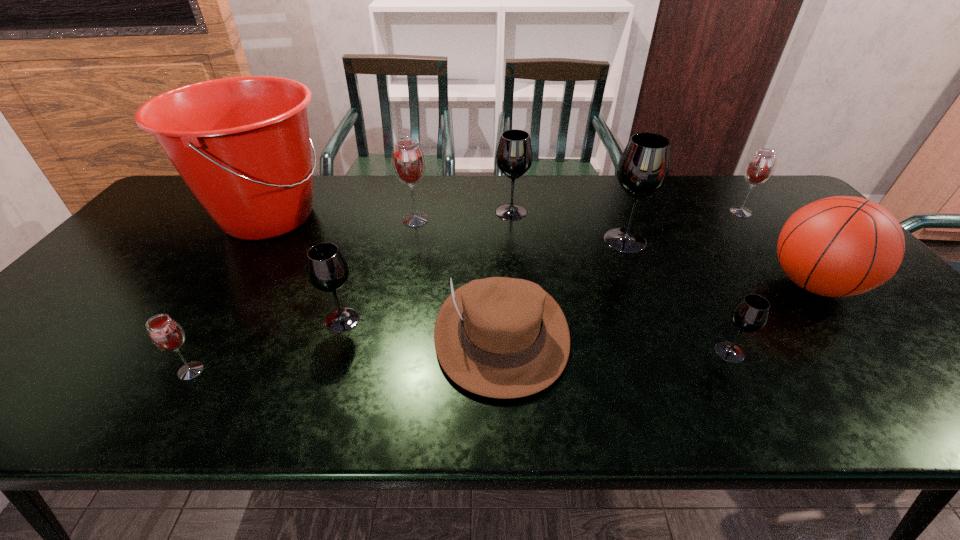
Find the location of a particular element. bucket is located at coordinates (241, 144).

Where is `red bucket`? red bucket is located at coordinates tap(241, 144).

At what (x,y) coordinates should I click in order to perform the action: click on the second tallest object. Please return your answer as a coordinate pair (x, y). Image resolution: width=960 pixels, height=540 pixels. Looking at the image, I should click on (643, 168).

Locate an element on the screen. The height and width of the screenshot is (540, 960). the third gray wineglass from left to right is located at coordinates (643, 168).

At what (x,y) coordinates should I click in order to perform the action: click on the farthest gray wineglass. Please return your answer as a coordinate pair (x, y). Looking at the image, I should click on (514, 155).

Find the location of a particular element. This screenshot has width=960, height=540. the second gray wineglass from left to right is located at coordinates (514, 155).

Locate an element on the screen. The height and width of the screenshot is (540, 960). the second red wineglass from left to right is located at coordinates (408, 160).

Where is `the biggest red wineglass`? The image size is (960, 540). the biggest red wineglass is located at coordinates (408, 160).

In order to click on basketball in this screenshot , I will do `click(840, 246)`.

Where is `the rightmost red wineglass`? The width and height of the screenshot is (960, 540). the rightmost red wineglass is located at coordinates (760, 167).